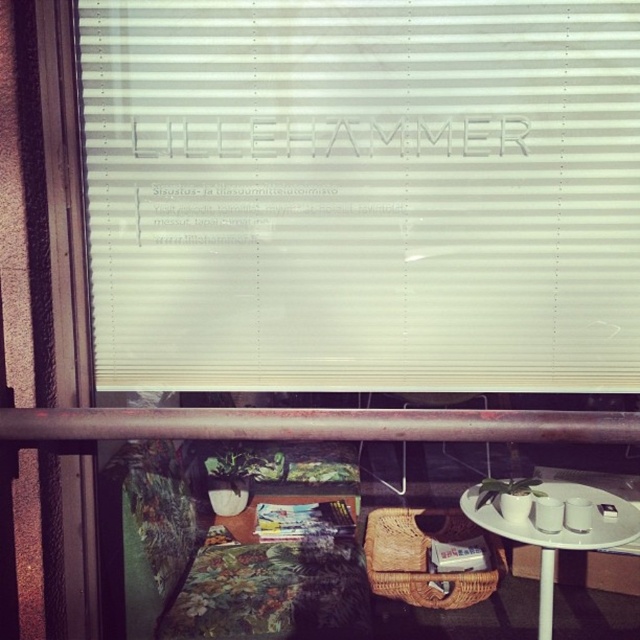
You are standing in a room and looking through the window. You see the point at coordinates (364,193). What object is located at that point?

The point at coordinates (364,193) indicates the white matte blinds at center.

You are standing on the balcony and want to place a small potted plant on the white ceramic table at lower right. However, there is already a wicker basket on the white matte blinds at center. Can you move the basket to the table to make space?

The white matte blinds at center is positioned on the left side of white ceramic table at lower right, so the wicker basket is already on the table. Therefore, there is no need to move anything.

You are a painter who wants to set up an easel on the balcony. The easel requires a space of 1.5 meters between the white matte blinds at center and the edge of the balcony. Is there enough space?

The white matte blinds at center are 1.62 meters apart, so yes, the easel can be placed there as the required space of 1.5 meters is available.